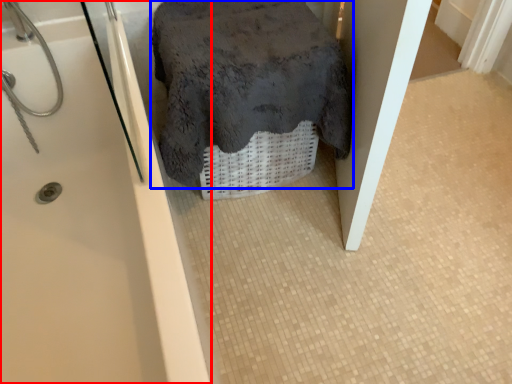
Question: Which point is closer to the camera, bathtub (highlighted by a red box) or bath towel (highlighted by a blue box)?

Choices:
 (A) bathtub
 (B) bath towel

Answer: (A)